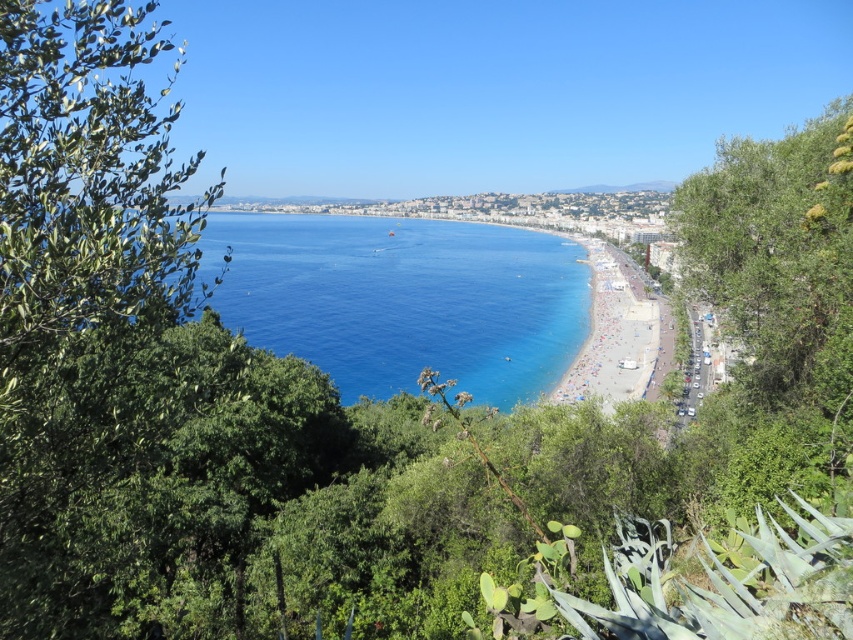
Can you confirm if green leafy tree at left is positioned to the right of blue liquid water at center?

Incorrect, green leafy tree at left is not on the right side of blue liquid water at center.

Is green leafy tree at left above blue liquid water at center?

No.

Between point (108, 20) and point (352, 352), which one is positioned behind?

The point (352, 352) is more distant.

Find the location of `green leafy tree at left`. green leafy tree at left is located at coordinates (88, 176).

Based on the photo, does blue liquid water at center have a greater width compared to light brown sand at center?

Indeed, blue liquid water at center has a greater width compared to light brown sand at center.

This screenshot has width=853, height=640. In order to click on blue liquid water at center in this screenshot , I will do `click(402, 300)`.

Which is behind, point (547, 292) or point (618, 336)?

Point (547, 292)

Identify the location of blue liquid water at center. (402, 300).

Is green leafy tree at left taller than light brown sand at center?

No, green leafy tree at left is not taller than light brown sand at center.

Is green leafy tree at left in front of light brown sand at center?

Yes, it is.

The width and height of the screenshot is (853, 640). I want to click on green leafy tree at left, so click(x=88, y=176).

Find the location of a particular element. The height and width of the screenshot is (640, 853). green leafy tree at left is located at coordinates tap(88, 176).